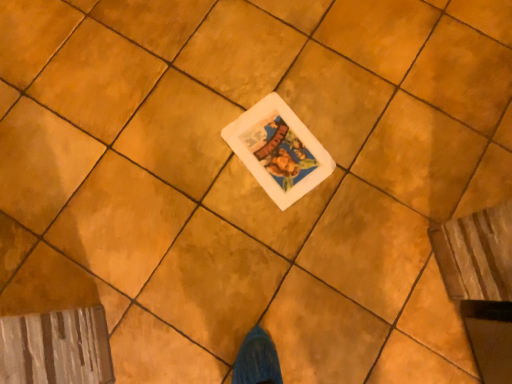
This screenshot has height=384, width=512. What are the coordinates of `empty space that is ontop of white matte comic book at center` in the screenshot? It's located at (278, 149).